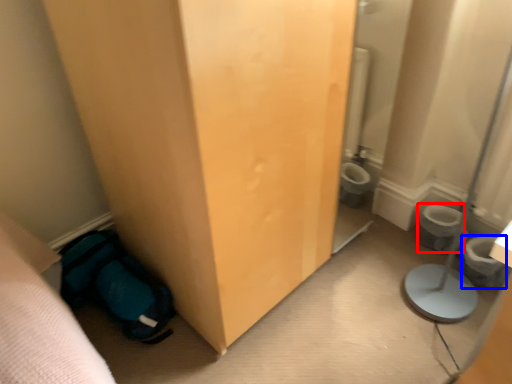
Question: Among these objects, which one is nearest to the camera, toilet bowl (highlighted by a red box) or potty (highlighted by a blue box)?

Choices:
 (A) toilet bowl
 (B) potty

Answer: (B)